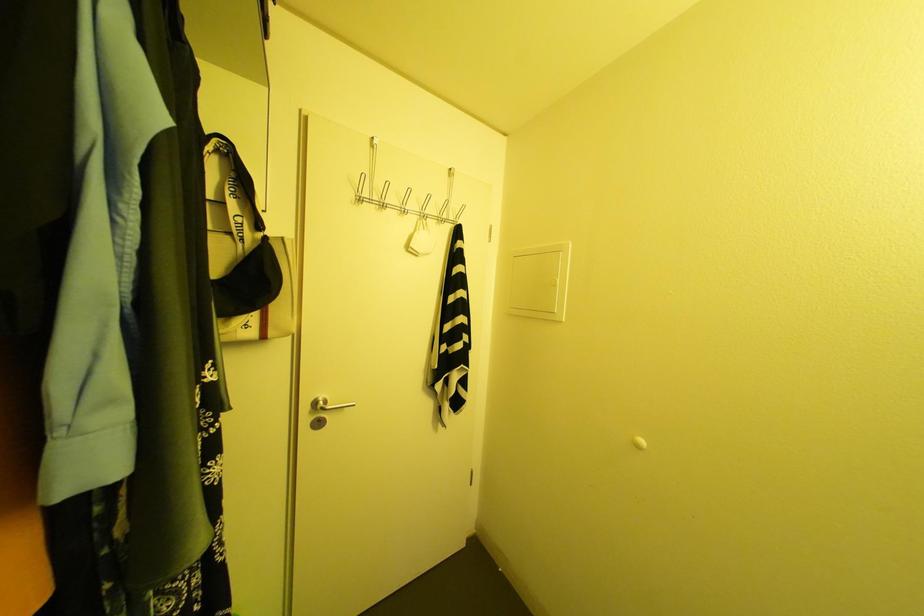
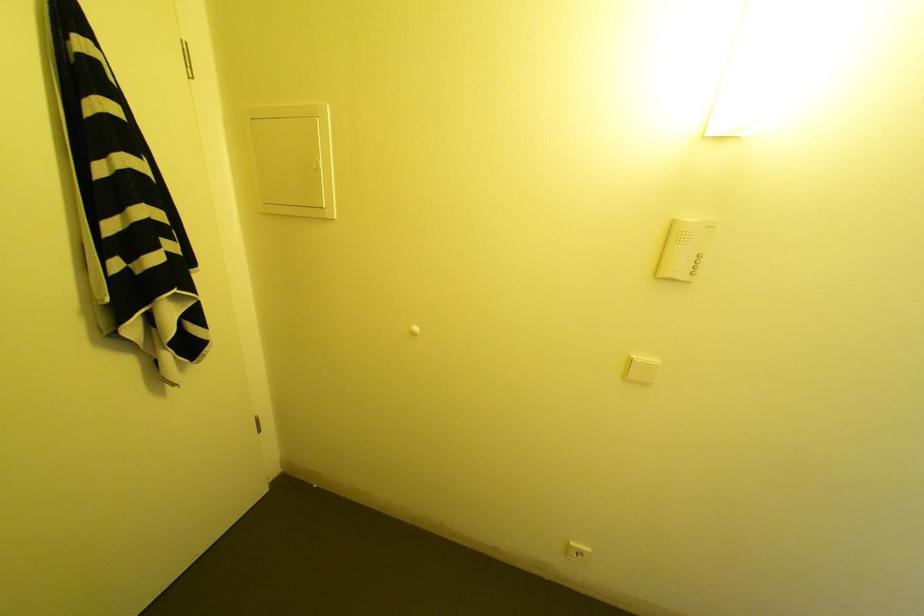
First-person continuous shooting, in which direction is the camera rotating?

The camera rotated toward right-down.